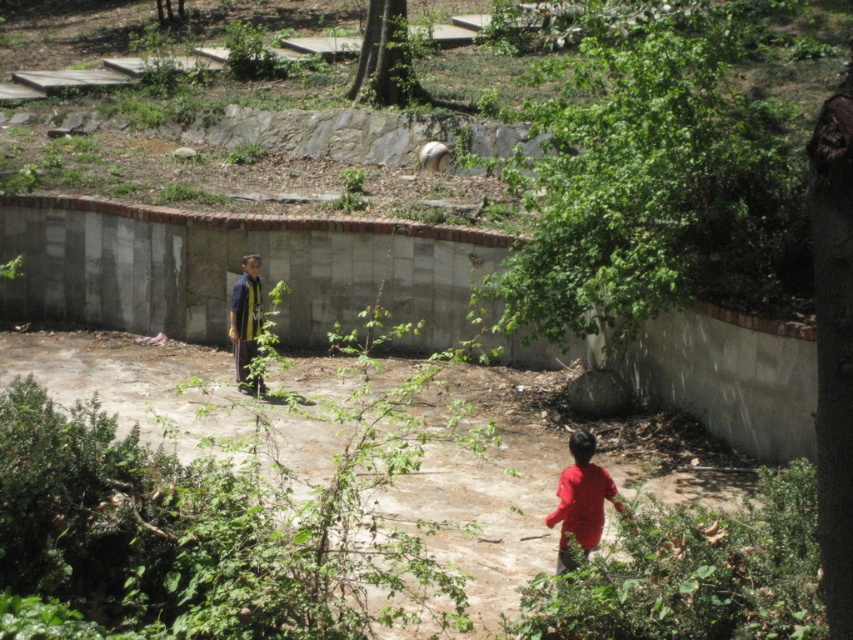
You are a construction worker standing at the edge of the concrete wall with a tool that requires a 5 meter reach. You need to pass the tool to the worker wearing the yellow jersey at center who is standing near the red matte shirt at lower right. Can you reach them with your tool?

The red matte shirt at lower right is 5.62 meters away from the yellow jersey at center. Since your tool only has a 5 meter reach, you cannot reach them directly.

You are a photographer positioned at the edge of the park. You notice two people wearing the red matte shirt at lower right and the yellow jersey at center. Which person is standing closer to the ground?

The red matte shirt at lower right is located below the yellow jersey at center, so the person wearing the red matte shirt at lower right is standing closer to the ground.

You are standing in the park and want to place a small garden ornament between the two points, point 1 at point (560, 572) and point 2 at point (231, 316). Which point is closer to you so you can start placing the ornament there?

Point (560, 572) is closer to the viewer than point (231, 316), so you should start placing the ornament near point (560, 572) first.